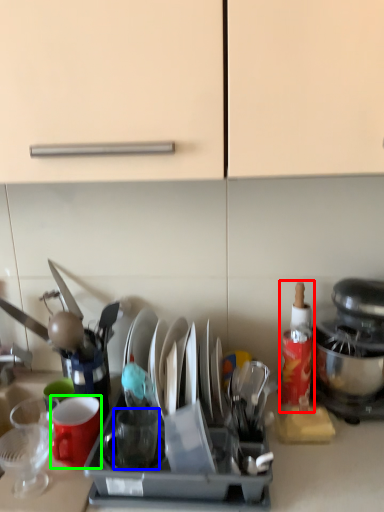
Question: Estimate the real-world distances between objects in this image. Which object is farther from bottle (highlighted by a red box), tableware (highlighted by a blue box) or coffee cup (highlighted by a green box)?

Choices:
 (A) tableware
 (B) coffee cup

Answer: (B)